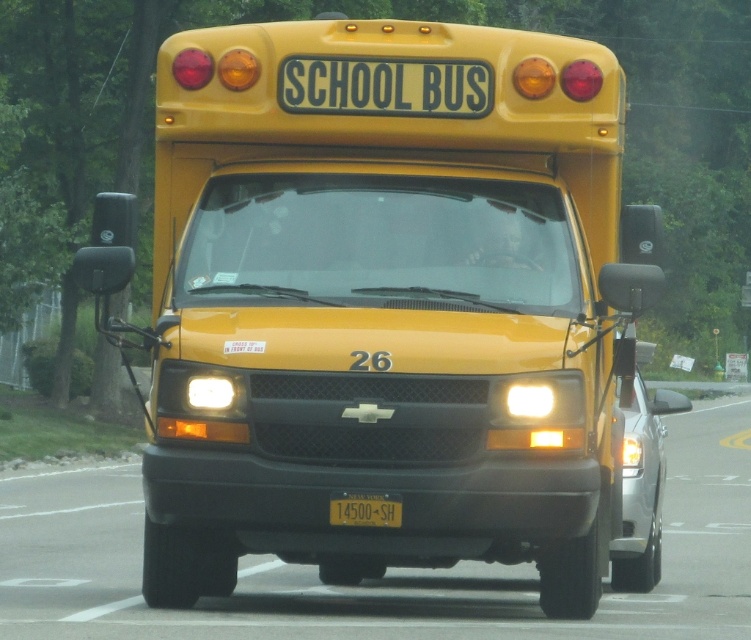
Question: Which object appears closest to the camera in this image?

Choices:
 (A) yellow matte/solid school bus at center
 (B) yellow matte license plate at center

Answer: (A)

Question: Among these objects, which one is nearest to the camera?

Choices:
 (A) yellow matte license plate at center
 (B) yellow matte/solid school bus at center

Answer: (B)

Question: Is yellow matte/solid school bus at center thinner than yellow matte license plate at center?

Choices:
 (A) yes
 (B) no

Answer: (B)

Question: Is yellow matte/solid school bus at center further to the viewer compared to yellow matte license plate at center?

Choices:
 (A) no
 (B) yes

Answer: (A)

Question: Which point appears farthest from the camera in this image?

Choices:
 (A) tap(234, 228)
 (B) tap(342, 502)

Answer: (A)

Question: Does yellow matte/solid school bus at center have a lesser width compared to yellow matte license plate at center?

Choices:
 (A) yes
 (B) no

Answer: (B)